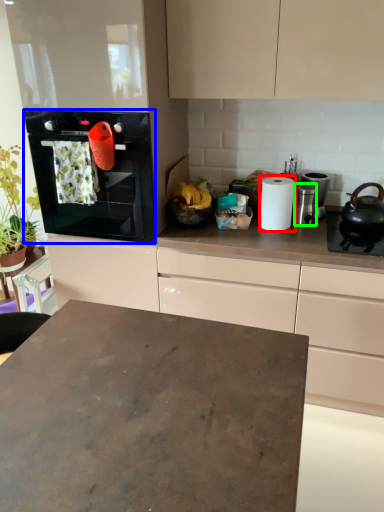
Question: Which object is positioned farthest from paper towel (highlighted by a red box)? Select from home appliance (highlighted by a blue box) and appliance (highlighted by a green box).

Choices:
 (A) home appliance
 (B) appliance

Answer: (A)